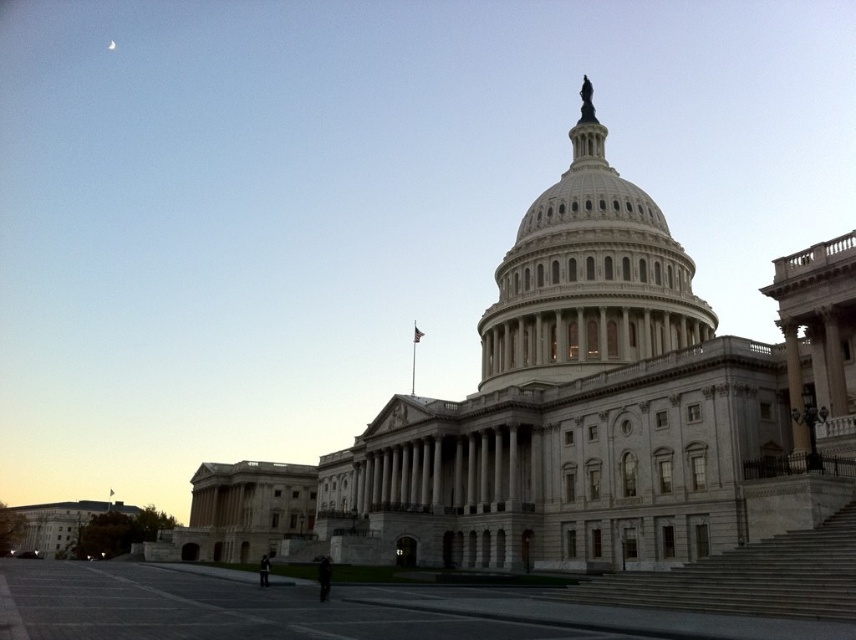
Is white marble dome at center behind gray stone stairs at lower right?

Yes, white marble dome at center is further from the viewer.

Can you confirm if white marble dome at center is positioned to the left of gray stone stairs at lower right?

Correct, you'll find white marble dome at center to the left of gray stone stairs at lower right.

I want to click on white marble dome at center, so click(587, 276).

Locate an element on the screen. The height and width of the screenshot is (640, 856). white marble dome at center is located at coordinates tap(587, 276).